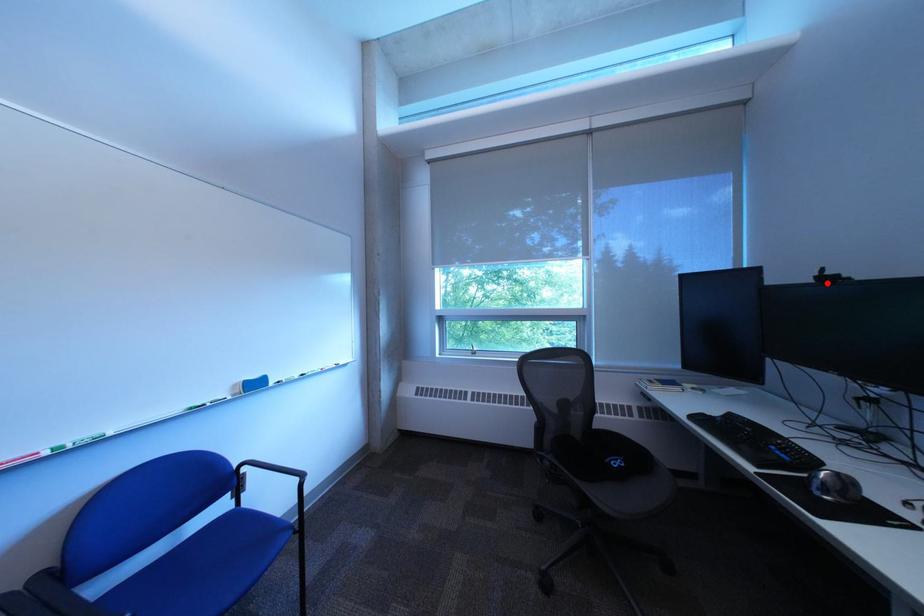
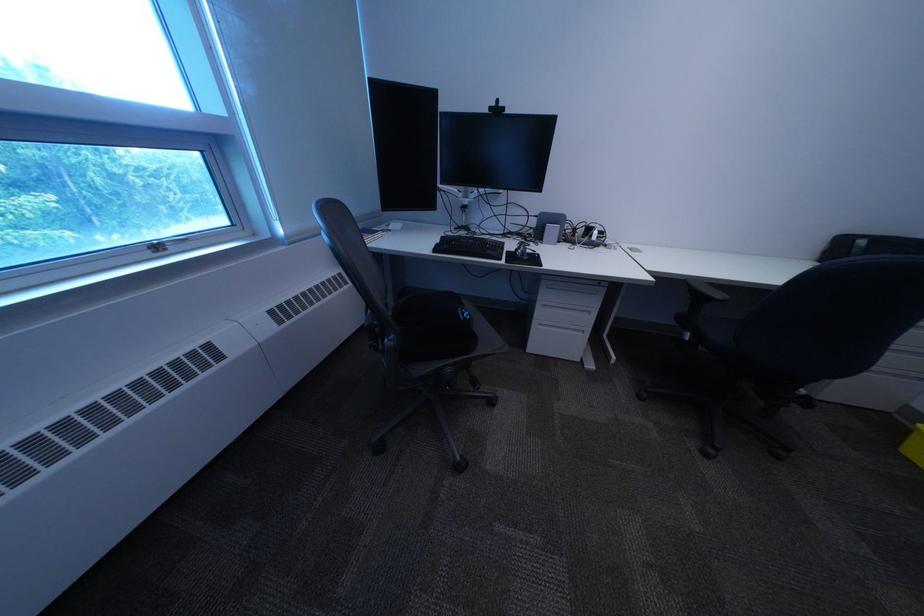
In the second image, find the point that corresponds to the highlighted location in the first image.

(503, 113)